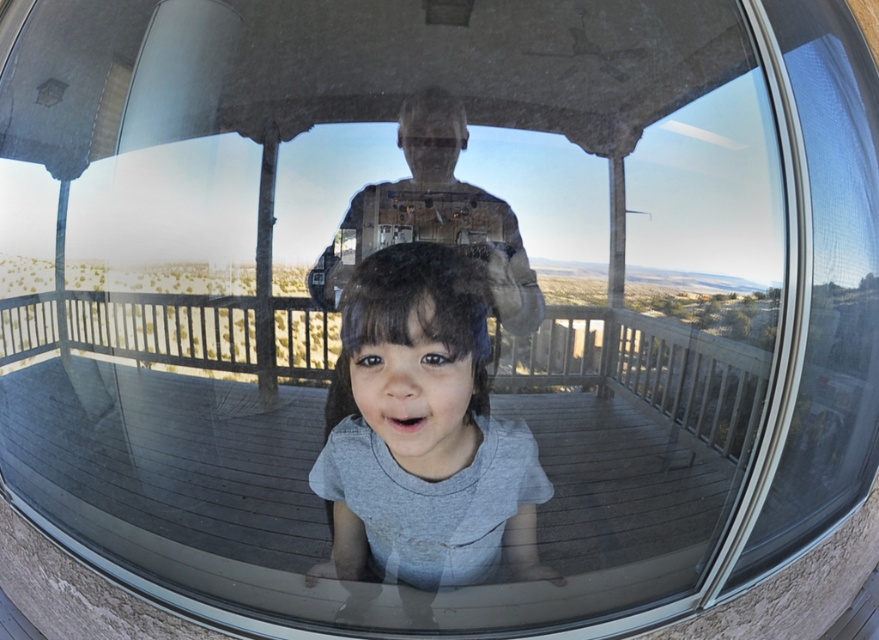
Is gray matte shirt at center wider than matte gray shirt at center?

No.

Describe the element at coordinates (420, 419) in the screenshot. I see `gray matte shirt at center` at that location.

Does point (427, 481) come in front of point (419, 176)?

Yes.

The height and width of the screenshot is (640, 879). In order to click on gray matte shirt at center in this screenshot , I will do `click(420, 419)`.